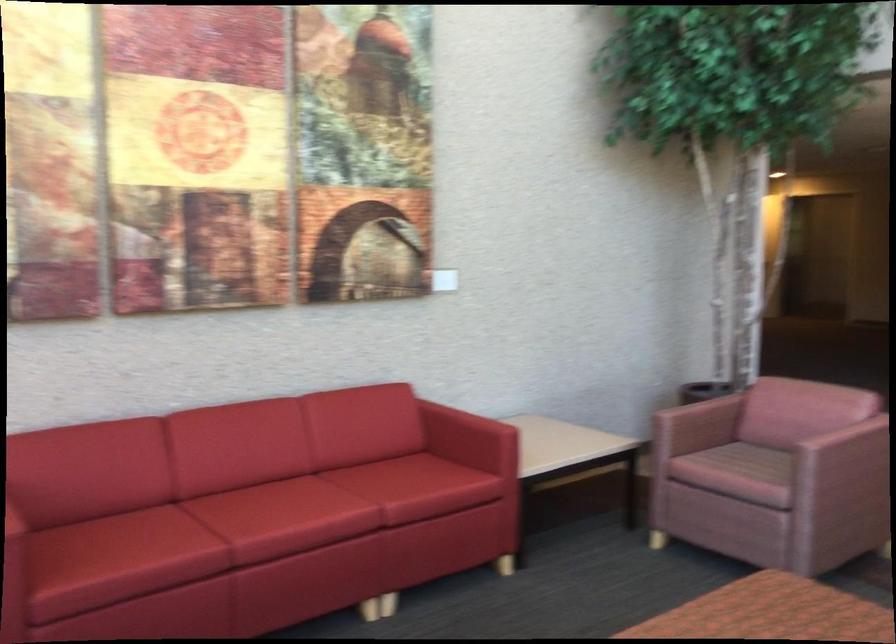
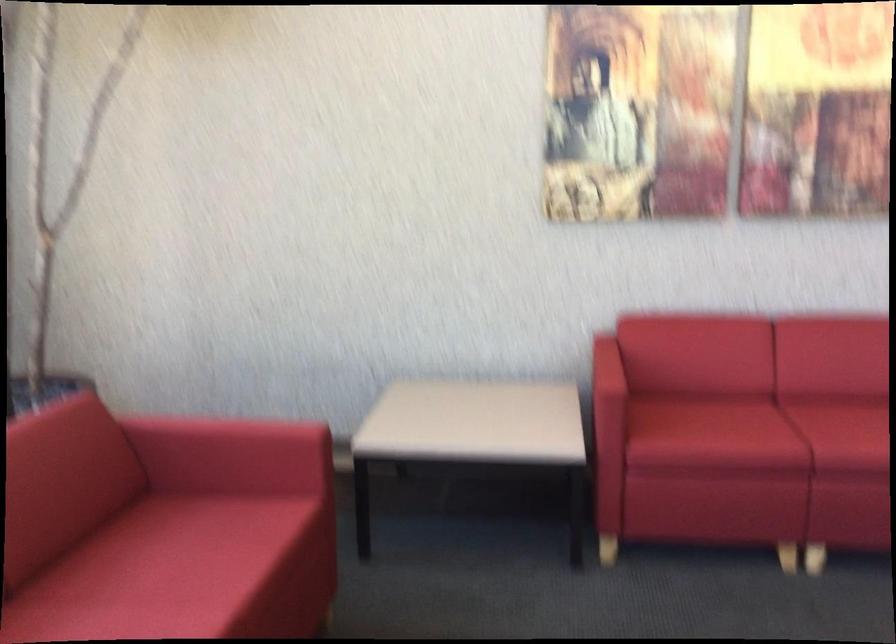
Question: The images are taken continuously from a first-person perspective. In which direction is your viewpoint rotating?

Choices:
 (A) Left
 (B) Right
 (C) Up
 (D) Down

Answer: (A)